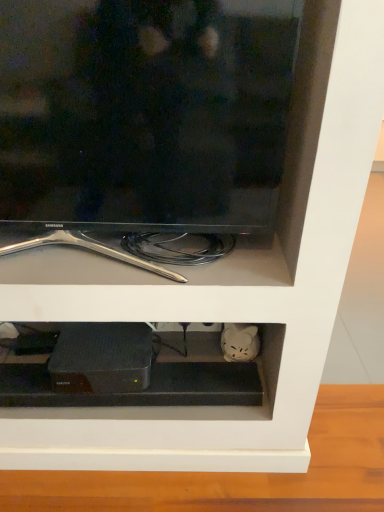
Locate an element on the screen. The width and height of the screenshot is (384, 512). black matte device at center is located at coordinates (135, 370).

The image size is (384, 512). Describe the element at coordinates (102, 358) in the screenshot. I see `black matte router at lower center` at that location.

Image resolution: width=384 pixels, height=512 pixels. I want to click on black glossy tv at upper center, so click(x=145, y=111).

What are the coordinates of `black matte device at center` in the screenshot? It's located at tap(135, 370).

Locate an element on the screen. appliance located in front of the black matte device at center is located at coordinates (102, 358).

From the picture: Can we say black matte router at lower center lies outside black matte device at center?

That's correct, black matte router at lower center is outside of black matte device at center.

Which is in front, point (67, 337) or point (153, 376)?

Positioned in front is point (153, 376).

Considering the sizes of objects black matte router at lower center and black matte device at center in the image provided, who is smaller, black matte router at lower center or black matte device at center?

black matte device at center.

Is black matte router at lower center not near black glossy tv at upper center?

No, black matte router at lower center is not far away from black glossy tv at upper center.

At what (x,y) coordinates should I click in order to perform the action: click on appliance on the left of black glossy tv at upper center. Please return your answer as a coordinate pair (x, y). The height and width of the screenshot is (512, 384). Looking at the image, I should click on (102, 358).

Based on their sizes in the image, would you say black matte router at lower center is bigger or smaller than black glossy tv at upper center?

Clearly, black matte router at lower center is smaller in size than black glossy tv at upper center.

Which object is further away from the camera taking this photo, black matte router at lower center or black glossy tv at upper center?

black matte router at lower center is further from the camera.

Between black glossy tv at upper center and black matte device at center, which one has larger width?

black matte device at center is wider.

Is black glossy tv at upper center shorter than black matte device at center?

In fact, black glossy tv at upper center may be taller than black matte device at center.

From the image's perspective, is black glossy tv at upper center located beneath black matte device at center?

No, from the image's perspective, black glossy tv at upper center is not below black matte device at center.

Between black glossy tv at upper center and black matte device at center, which one appears on the right side from the viewer's perspective?

Positioned to the right is black glossy tv at upper center.

Identify the location of cabinet behind the black glossy tv at upper center. (135, 370).

Are black matte device at center and black glossy tv at upper center beside each other?

No, black matte device at center is not making contact with black glossy tv at upper center.

In the image, is black matte device at center positioned in front of or behind black glossy tv at upper center?

In the image, black matte device at center appears behind black glossy tv at upper center.

How different are the orientations of black matte device at center and black matte router at lower center in degrees?

6.22 degrees separate the facing orientations of black matte device at center and black matte router at lower center.

Is black matte device at center looking in the opposite direction of black matte router at lower center?

No, black matte router at lower center is not at the back of black matte device at center.

Is black matte device at center next to black matte router at lower center?

Yes, black matte device at center is next to black matte router at lower center.

Between black glossy tv at upper center and black matte router at lower center, which one appears on the left side from the viewer's perspective?

Positioned to the left is black matte router at lower center.

Is black glossy tv at upper center not near black matte router at lower center?

black glossy tv at upper center is near black matte router at lower center, not far away.

Consider the image. Can you confirm if black glossy tv at upper center is smaller than black matte router at lower center?

No, black glossy tv at upper center is not smaller than black matte router at lower center.

Looking at their sizes, would you say black glossy tv at upper center is wider or thinner than black matte router at lower center?

Considering their sizes, black glossy tv at upper center looks slimmer than black matte router at lower center.

Find the location of a particular element. The width and height of the screenshot is (384, 512). appliance lying on the left of black matte device at center is located at coordinates (102, 358).

Where is `television that is above the black matte router at lower center (from a real-world perspective)`? The width and height of the screenshot is (384, 512). television that is above the black matte router at lower center (from a real-world perspective) is located at coordinates (145, 111).

Which object lies nearer to the anchor point black matte device at center, black glossy tv at upper center or black matte router at lower center?

black matte router at lower center lies closer to black matte device at center than the other object.

From the image, which object appears to be nearer to black glossy tv at upper center, black matte router at lower center or black matte device at center?

black matte device at center lies closer to black glossy tv at upper center than the other object.

Based on their spatial positions, is black matte router at lower center or black glossy tv at upper center closer to black matte device at center?

black matte router at lower center is closer to black matte device at center.

When comparing their distances from black matte router at lower center, does black glossy tv at upper center or black matte device at center seem further?

black glossy tv at upper center.

Considering their positions, is black matte device at center positioned further to black matte router at lower center than black glossy tv at upper center?

The object further to black matte router at lower center is black glossy tv at upper center.

Considering their positions, is black matte device at center positioned further to black glossy tv at upper center than black matte router at lower center?

Based on the image, black matte router at lower center appears to be further to black glossy tv at upper center.

This screenshot has height=512, width=384. Find the location of `appliance between black glossy tv at upper center and black matte device at center in the up-down direction`. appliance between black glossy tv at upper center and black matte device at center in the up-down direction is located at coordinates (102, 358).